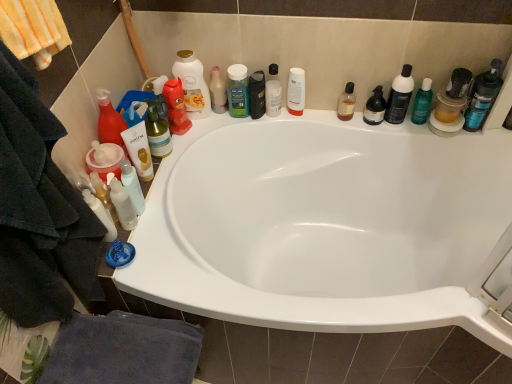
Measure the distance between point (397, 83) and camera.

Point (397, 83) is 4.33 feet away from camera.

You are a GUI agent. You are given a task and a screenshot of the screen. Output one action in this format:
    pyautogui.click(x=<x>, y=<y>)
    Task: Click on the pantene gold tube at left, the sixth toiletry in the right-to-left sequence
    This screenshot has height=384, width=512.
    Given the screenshot: What is the action you would take?
    pyautogui.click(x=139, y=150)

Measure the distance between point (143, 148) and camera.

Point (143, 148) and camera are 1.23 meters apart from each other.

What do you see at coordinates (422, 102) in the screenshot?
I see `green glossy bottle at upper right, arranged as the seventh toiletry when viewed from the left` at bounding box center [422, 102].

This screenshot has height=384, width=512. Describe the element at coordinates (375, 107) in the screenshot. I see `translucent plastic spray bottle at upper right, acting as the sixth toiletry starting from the left` at that location.

The image size is (512, 384). I want to click on black glossy mouthwash at upper right, the 6th mouthwash from the left, so tap(399, 96).

What's the angular difference between white glossy mouthwash at upper center, positioned as the 5th mouthwash in right-to-left order, and dark blue towel at lower left's facing directions?

The facing directions of white glossy mouthwash at upper center, positioned as the 5th mouthwash in right-to-left order, and dark blue towel at lower left are 90 degrees apart.

Is dark blue towel at lower left at the back of white glossy mouthwash at upper center, positioned as the 5th mouthwash in right-to-left order?

No, white glossy mouthwash at upper center, positioned as the 5th mouthwash in right-to-left order, is not facing away from dark blue towel at lower left.

Looking at this image, from the image's perspective, which object appears higher, white glossy mouthwash at upper center, arranged as the second mouthwash when viewed from the left, or dark blue towel at lower left?

white glossy mouthwash at upper center, arranged as the second mouthwash when viewed from the left.

From the image's perspective, which toiletry is the 4th one below the translucent amber liquid at upper right, acting as the 5th mouthwash starting from the left? Please provide its 2D coordinates.

[(139, 150)]

Does pantene gold tube at left, which ranks as the second toiletry in left-to-right order, contain translucent amber liquid at upper right, acting as the 5th mouthwash starting from the left?

No.

Which is more to the right, pantene gold tube at left, which ranks as the second toiletry in left-to-right order, or translucent amber liquid at upper right, the 2th mouthwash viewed from the right?

Positioned to the right is translucent amber liquid at upper right, the 2th mouthwash viewed from the right.

From the picture: Is white matte bottle at upper center, arranged as the 3th mouthwash when viewed from the right, next to translucent plastic bottle at upper center, which is the 4th toiletry in right-to-left order, and touching it?

No.

Who is bigger, white matte bottle at upper center, arranged as the 3th mouthwash when viewed from the right, or translucent plastic bottle at upper center, which is the 4th toiletry in right-to-left order?

white matte bottle at upper center, arranged as the 3th mouthwash when viewed from the right.

Could you tell me if white matte bottle at upper center, arranged as the 3th mouthwash when viewed from the right, is turned towards translucent plastic bottle at upper center, marked as the 4th toiletry in a left-to-right arrangement?

No, white matte bottle at upper center, arranged as the 3th mouthwash when viewed from the right, is not oriented towards translucent plastic bottle at upper center, marked as the 4th toiletry in a left-to-right arrangement.

From the picture: Who is taller, white matte bottle at upper center, arranged as the 3th mouthwash when viewed from the right, or translucent plastic bottle at upper center, which is the 4th toiletry in right-to-left order?

white matte bottle at upper center, arranged as the 3th mouthwash when viewed from the right, is taller.

Choose the correct answer: Is white glossy mouthwash at upper center, positioned as the 5th mouthwash in right-to-left order, inside transparent plastic bottle at upper center, positioned as the third mouthwash in left-to-right order, or outside it?

white glossy mouthwash at upper center, positioned as the 5th mouthwash in right-to-left order, is not enclosed by transparent plastic bottle at upper center, positioned as the third mouthwash in left-to-right order.

From a real-world perspective, which mouthwash is the 2nd one underneath the white glossy mouthwash at upper center, arranged as the second mouthwash when viewed from the left? Please provide its 2D coordinates.

[(273, 92)]

Is point (203, 99) positioned before point (272, 91)?

Yes, point (203, 99) is in front of point (272, 91).

How much distance is there between white glossy mouthwash at upper center, arranged as the second mouthwash when viewed from the left, and transparent plastic bottle at upper center, positioned as the third mouthwash in left-to-right order?

The distance of white glossy mouthwash at upper center, arranged as the second mouthwash when viewed from the left, from transparent plastic bottle at upper center, positioned as the third mouthwash in left-to-right order, is 24.02 centimeters.

Is translucent plastic spray bottle at upper right, acting as the sixth toiletry starting from the left, facing away from pantene gold tube at left, the sixth toiletry in the right-to-left sequence?

No, translucent plastic spray bottle at upper right, acting as the sixth toiletry starting from the left,'s orientation is not away from pantene gold tube at left, the sixth toiletry in the right-to-left sequence.

Consider the image. Between translucent plastic spray bottle at upper right, acting as the sixth toiletry starting from the left, and pantene gold tube at left, the sixth toiletry in the right-to-left sequence, which one has larger size?

With larger size is pantene gold tube at left, the sixth toiletry in the right-to-left sequence.

From the image's perspective, is translucent plastic spray bottle at upper right, which is counted as the 2th toiletry, starting from the right, over pantene gold tube at left, which ranks as the second toiletry in left-to-right order?

Yes, from the image's perspective, translucent plastic spray bottle at upper right, which is counted as the 2th toiletry, starting from the right, is above pantene gold tube at left, which ranks as the second toiletry in left-to-right order.

Measure the distance from translucent plastic spray bottle at upper right, acting as the sixth toiletry starting from the left, to pantene gold tube at left, which ranks as the second toiletry in left-to-right order.

They are 74.78 centimeters apart.

Considering the sizes of objects white glossy lotion at lower left, placed as the 1th toiletry when sorted from left to right, and pantene gold tube at left, the sixth toiletry in the right-to-left sequence, in the image provided, who is shorter, white glossy lotion at lower left, placed as the 1th toiletry when sorted from left to right, or pantene gold tube at left, the sixth toiletry in the right-to-left sequence,?

white glossy lotion at lower left, placed as the 1th toiletry when sorted from left to right, is shorter.

How different are the orientations of white glossy lotion at lower left, placed as the 1th toiletry when sorted from left to right, and pantene gold tube at left, the sixth toiletry in the right-to-left sequence, in degrees?

0.000248 degrees.

Is white glossy lotion at lower left, placed as the 1th toiletry when sorted from left to right, turned away from pantene gold tube at left, the sixth toiletry in the right-to-left sequence?

That's not correct — white glossy lotion at lower left, placed as the 1th toiletry when sorted from left to right, is not looking away from pantene gold tube at left, the sixth toiletry in the right-to-left sequence.

Is white glossy lotion at lower left, placed as the 1th toiletry when sorted from left to right, bigger than pantene gold tube at left, the sixth toiletry in the right-to-left sequence?

No, white glossy lotion at lower left, placed as the 1th toiletry when sorted from left to right, is not bigger than pantene gold tube at left, the sixth toiletry in the right-to-left sequence.

In terms of size, does white glossy mouthwash at upper center, positioned as the 5th mouthwash in right-to-left order, appear bigger or smaller than black glossy mouthwash at upper right, acting as the 1th mouthwash starting from the right?

Clearly, white glossy mouthwash at upper center, positioned as the 5th mouthwash in right-to-left order, is larger in size than black glossy mouthwash at upper right, acting as the 1th mouthwash starting from the right.

Is white glossy mouthwash at upper center, positioned as the 5th mouthwash in right-to-left order, far from black glossy mouthwash at upper right, acting as the 1th mouthwash starting from the right?

That's not correct — white glossy mouthwash at upper center, positioned as the 5th mouthwash in right-to-left order, is a little close to black glossy mouthwash at upper right, acting as the 1th mouthwash starting from the right.

Is black glossy mouthwash at upper right, acting as the 1th mouthwash starting from the right, located within white glossy mouthwash at upper center, positioned as the 5th mouthwash in right-to-left order?

That's incorrect, black glossy mouthwash at upper right, acting as the 1th mouthwash starting from the right, is not inside white glossy mouthwash at upper center, positioned as the 5th mouthwash in right-to-left order.

Considering the positions of objects white glossy mouthwash at upper center, arranged as the second mouthwash when viewed from the left, and black glossy mouthwash at upper right, the 6th mouthwash from the left, in the image provided, who is more to the right, white glossy mouthwash at upper center, arranged as the second mouthwash when viewed from the left, or black glossy mouthwash at upper right, the 6th mouthwash from the left,?

black glossy mouthwash at upper right, the 6th mouthwash from the left.

Where is `bath towel located on the left of white glossy mouthwash at upper center, positioned as the 5th mouthwash in right-to-left order`? This screenshot has height=384, width=512. bath towel located on the left of white glossy mouthwash at upper center, positioned as the 5th mouthwash in right-to-left order is located at coordinates (123, 351).

At what (x,y) coordinates should I click in order to perform the action: click on the 4th mouthwash to the right when counting from the pantene gold tube at left, which ranks as the second toiletry in left-to-right order. Please return your answer as a coordinate pair (x, y). Looking at the image, I should click on (346, 103).

Looking at the image, which one is located closer to white matte bottle at upper center, arranged as the 3th mouthwash when viewed from the right, rubberized plastic toy at upper left, which ranks as the 5th toiletry in right-to-left order, or translucent plastic bottle at upper center, marked as the 4th toiletry in a left-to-right arrangement?

translucent plastic bottle at upper center, marked as the 4th toiletry in a left-to-right arrangement, lies closer to white matte bottle at upper center, arranged as the 3th mouthwash when viewed from the right, than the other object.

Estimate the real-world distances between objects in this image. Which object is further from white glossy lotion at lower left, placed as the 1th toiletry when sorted from left to right, translucent amber liquid at upper right, the 2th mouthwash viewed from the right, or translucent plastic spray bottle at upper right, which is counted as the 2th toiletry, starting from the right?

The object further to white glossy lotion at lower left, placed as the 1th toiletry when sorted from left to right, is translucent plastic spray bottle at upper right, which is counted as the 2th toiletry, starting from the right.

Estimate the real-world distances between objects in this image. Which object is closer to green glossy bottle at upper right, arranged as the seventh toiletry when viewed from the left, translucent plastic bottle at upper center, which is the 4th toiletry in right-to-left order, or black matte bottle at center?

black matte bottle at center is positioned closer to the anchor green glossy bottle at upper right, arranged as the seventh toiletry when viewed from the left.

Which object lies nearer to the anchor point black matte bottle at center, translucent amber liquid at upper right, the 2th mouthwash viewed from the right, or translucent plastic bottle at upper center, which is the 4th toiletry in right-to-left order?

translucent plastic bottle at upper center, which is the 4th toiletry in right-to-left order.

Considering their positions, is white glossy lotion at lower left, marked as the 7th toiletry in a right-to-left arrangement, positioned further to rubberized plastic toy at upper left, which ranks as the 5th toiletry in right-to-left order, than black glossy mouthwash at upper right, acting as the 1th mouthwash starting from the right?

The object further to rubberized plastic toy at upper left, which ranks as the 5th toiletry in right-to-left order, is black glossy mouthwash at upper right, acting as the 1th mouthwash starting from the right.

When comparing their distances from black matte bottle at center, does black glossy mouthwash at upper right, the 6th mouthwash from the left, or translucent amber liquid at upper right, the 2th mouthwash viewed from the right, seem closer?

translucent amber liquid at upper right, the 2th mouthwash viewed from the right, is closer to black matte bottle at center.

Based on their spatial positions, is black glossy mouthwash at upper right, acting as the 1th mouthwash starting from the right, or white glossy lotion at lower left, placed as the 1th toiletry when sorted from left to right, further from translucent plastic spray bottle at upper right, acting as the sixth toiletry starting from the left?

Among the two, white glossy lotion at lower left, placed as the 1th toiletry when sorted from left to right, is located further to translucent plastic spray bottle at upper right, acting as the sixth toiletry starting from the left.

Based on the photo, considering their positions, is transparent plastic bottle at upper center, the 4th mouthwash when ordered from right to left, positioned further to translucent plastic bottle at upper center, which is the 4th toiletry in right-to-left order, than dark blue towel at lower left?

Based on the image, dark blue towel at lower left appears to be further to translucent plastic bottle at upper center, which is the 4th toiletry in right-to-left order.

Find the location of a particular element. The width and height of the screenshot is (512, 384). toiletry between translucent plastic bottle at upper center, marked as the fifth toiletry in a left-to-right arrangement, and green glossy bottle at upper right, arranged as the seventh toiletry when viewed from the left, in the horizontal direction is located at coordinates (375, 107).

Find the location of a particular element. toiletry located between black matte bottle at center and green glossy bottle at upper right, marked as the 1th toiletry in a right-to-left arrangement, in the left-right direction is located at coordinates (375, 107).

Locate an element on the screen. The height and width of the screenshot is (384, 512). bottle between white glossy bottle at lower left, placed as the first mouthwash when sorted from left to right, and translucent plastic spray bottle at upper right, which is counted as the 2th toiletry, starting from the right, from left to right is located at coordinates (257, 94).

The image size is (512, 384). What are the coordinates of `mouthwash located between black matte bottle at center and white matte bottle at upper center, the 4th mouthwash when ordered from left to right, in the left-right direction` in the screenshot? It's located at (273, 92).